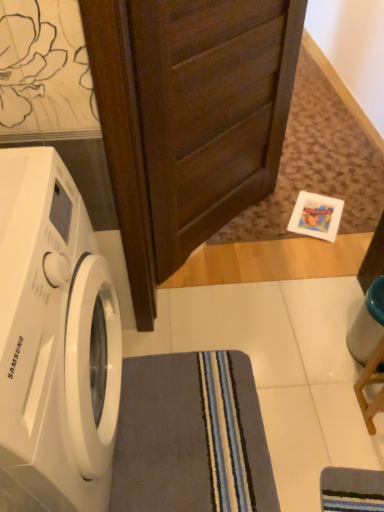
Question: From a real-world perspective, is gray soft rug at lower center on top of dark wood screen door at upper center?

Choices:
 (A) no
 (B) yes

Answer: (A)

Question: Considering the relative positions of gray soft rug at lower center and dark wood screen door at upper center in the image provided, is gray soft rug at lower center in front of dark wood screen door at upper center?

Choices:
 (A) no
 (B) yes

Answer: (A)

Question: Is gray soft rug at lower center taller than dark wood screen door at upper center?

Choices:
 (A) no
 (B) yes

Answer: (A)

Question: Does gray soft rug at lower center have a smaller size compared to dark wood screen door at upper center?

Choices:
 (A) yes
 (B) no

Answer: (A)

Question: From a real-world perspective, is gray soft rug at lower center physically below dark wood screen door at upper center?

Choices:
 (A) yes
 (B) no

Answer: (A)

Question: Is point (152, 146) closer or farther from the camera than point (6, 416)?

Choices:
 (A) closer
 (B) farther

Answer: (B)

Question: In terms of size, does dark wood screen door at upper center appear bigger or smaller than white glossy washing machine at left?

Choices:
 (A) big
 (B) small

Answer: (B)

Question: From a real-world perspective, is dark wood screen door at upper center above or below white glossy washing machine at left?

Choices:
 (A) below
 (B) above

Answer: (B)

Question: Considering the relative positions of dark wood screen door at upper center and white glossy washing machine at left in the image provided, is dark wood screen door at upper center to the left or to the right of white glossy washing machine at left?

Choices:
 (A) right
 (B) left

Answer: (A)

Question: From a real-world perspective, is gray soft rug at lower center above or below white glossy washing machine at left?

Choices:
 (A) above
 (B) below

Answer: (B)

Question: Is gray soft rug at lower center spatially inside white glossy washing machine at left, or outside of it?

Choices:
 (A) inside
 (B) outside

Answer: (B)

Question: Is gray soft rug at lower center bigger or smaller than white glossy washing machine at left?

Choices:
 (A) small
 (B) big

Answer: (A)

Question: Considering their positions, is gray soft rug at lower center located in front of or behind white glossy washing machine at left?

Choices:
 (A) behind
 (B) front

Answer: (A)

Question: Considering their positions, is dark wood screen door at upper center located in front of or behind gray soft rug at lower center?

Choices:
 (A) front
 (B) behind

Answer: (A)

Question: Is dark wood screen door at upper center inside the boundaries of gray soft rug at lower center, or outside?

Choices:
 (A) outside
 (B) inside

Answer: (A)